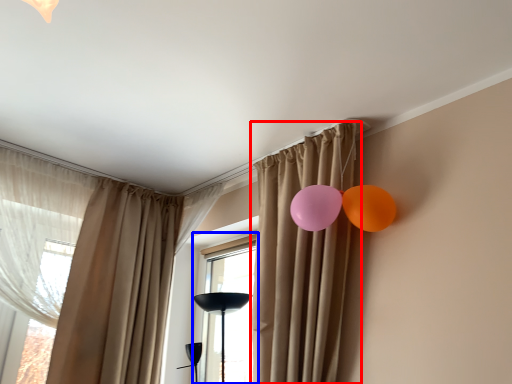
Question: Among these objects, which one is nearest to the camera, curtain (highlighted by a red box) or window (highlighted by a blue box)?

Choices:
 (A) curtain
 (B) window

Answer: (A)